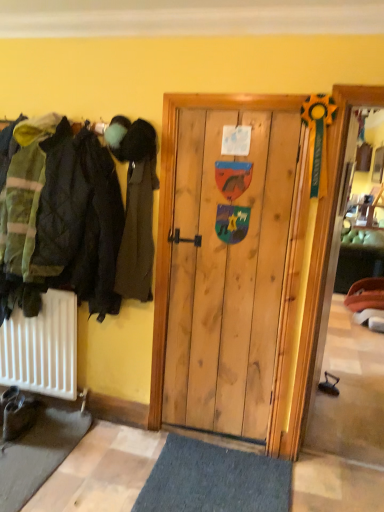
You are a GUI agent. You are given a task and a screenshot of the screen. Output one action in this format:
    pyautogui.click(x=<x>, y=<y>)
    Task: Click on the dark green fabric coat at left
    Image resolution: width=384 pixels, height=512 pixels.
    Given the screenshot: What is the action you would take?
    click(x=135, y=205)

Measure the distance between point (137,186) and camera.

They are 7.23 feet apart.

Describe the element at coordinates (135, 205) in the screenshot. I see `dark green fabric coat at left` at that location.

Measure the distance between point (8, 430) and camera.

The distance of point (8, 430) from camera is 7.87 feet.

In order to face brown leather boot at lower left, should I rotate leftwards or rightwards?

Result: To face it directly, rotate left by 21.916 degrees.

What do you see at coordinates (19, 416) in the screenshot? I see `brown leather boot at lower left` at bounding box center [19, 416].

At what (x,y) coordinates should I click in order to perform the action: click on brown leather boot at lower left. Please return your answer as a coordinate pair (x, y). The image size is (384, 512). Looking at the image, I should click on (19, 416).

Image resolution: width=384 pixels, height=512 pixels. What are the coordinates of `dark green fabric coat at left` in the screenshot? It's located at (135, 205).

In the scene shown: Is dark green fabric coat at left at the right side of brown leather boot at lower left?

Indeed, dark green fabric coat at left is positioned on the right side of brown leather boot at lower left.

Considering the positions of objects dark green fabric coat at left and brown leather boot at lower left in the image provided, who is behind, dark green fabric coat at left or brown leather boot at lower left?

brown leather boot at lower left is further away from the camera.

Is point (115, 150) positioned after point (37, 410)?

No, it is not.

Looking at this image, from the image's perspective, which one is positioned lower, dark green fabric coat at left or brown leather boot at lower left?

brown leather boot at lower left, from the image's perspective.

From a real-world perspective, is dark green fabric coat at left physically above brown leather boot at lower left?

Indeed, from a real-world perspective, dark green fabric coat at left stands above brown leather boot at lower left.

Can you confirm if dark green fabric coat at left is thinner than brown leather boot at lower left?

Indeed, dark green fabric coat at left has a lesser width compared to brown leather boot at lower left.

Is dark green fabric coat at left taller than brown leather boot at lower left?

Yes, dark green fabric coat at left is taller than brown leather boot at lower left.

Considering the sizes of objects dark green fabric coat at left and brown leather boot at lower left in the image provided, who is bigger, dark green fabric coat at left or brown leather boot at lower left?

dark green fabric coat at left.

Is dark green fabric coat at left spatially inside brown leather boot at lower left, or outside of it?

dark green fabric coat at left is outside brown leather boot at lower left.

Is dark green fabric coat at left beside brown leather boot at lower left?

There is a gap between dark green fabric coat at left and brown leather boot at lower left.

Is dark green fabric coat at left oriented away from brown leather boot at lower left?

That's not correct — dark green fabric coat at left is not looking away from brown leather boot at lower left.

How many degrees apart are the facing directions of dark green fabric coat at left and brown leather boot at lower left?

9.58 degrees.

Measure the distance from dark green fabric coat at left to brown leather boot at lower left.

4.03 feet.

You are a GUI agent. You are given a task and a screenshot of the screen. Output one action in this format:
    pyautogui.click(x=<x>, y=<y>)
    Task: Click on the person that appears on the right of brown leather boot at lower left
    
    Given the screenshot: What is the action you would take?
    pyautogui.click(x=135, y=205)

Between brown leather boot at lower left and dark green fabric coat at left, which one appears on the right side from the viewer's perspective?

From the viewer's perspective, dark green fabric coat at left appears more on the right side.

Which is in front, brown leather boot at lower left or dark green fabric coat at left?

Positioned in front is dark green fabric coat at left.

Which is further, [11,410] or [146,276]?

The point [11,410] is more distant.

From the image's perspective, is brown leather boot at lower left under dark green fabric coat at left?

Yes.

From a real-world perspective, is brown leather boot at lower left under dark green fabric coat at left?

Correct, in the physical world, brown leather boot at lower left is lower than dark green fabric coat at left.

Which of these two, brown leather boot at lower left or dark green fabric coat at left, is thinner?

dark green fabric coat at left is thinner.

Looking at this image, is brown leather boot at lower left taller or shorter than dark green fabric coat at left?

brown leather boot at lower left is shorter than dark green fabric coat at left.

Looking at the image, does brown leather boot at lower left seem bigger or smaller compared to dark green fabric coat at left?

Clearly, brown leather boot at lower left is smaller in size than dark green fabric coat at left.

Is brown leather boot at lower left inside the boundaries of dark green fabric coat at left, or outside?

brown leather boot at lower left exists outside the volume of dark green fabric coat at left.

Are brown leather boot at lower left and dark green fabric coat at left making contact?

brown leather boot at lower left and dark green fabric coat at left are clearly separated.

Does brown leather boot at lower left turn towards dark green fabric coat at left?

No, brown leather boot at lower left does not turn towards dark green fabric coat at left.

How distant is brown leather boot at lower left from dark green fabric coat at left?

brown leather boot at lower left is 4.03 feet away from dark green fabric coat at left.

Locate an element on the screen. footwear that appears below the dark green fabric coat at left (from a real-world perspective) is located at coordinates (19, 416).

This screenshot has width=384, height=512. I want to click on person located in front of the brown leather boot at lower left, so click(x=135, y=205).

Locate an element on the screen. Image resolution: width=384 pixels, height=512 pixels. person located on the right of brown leather boot at lower left is located at coordinates (135, 205).